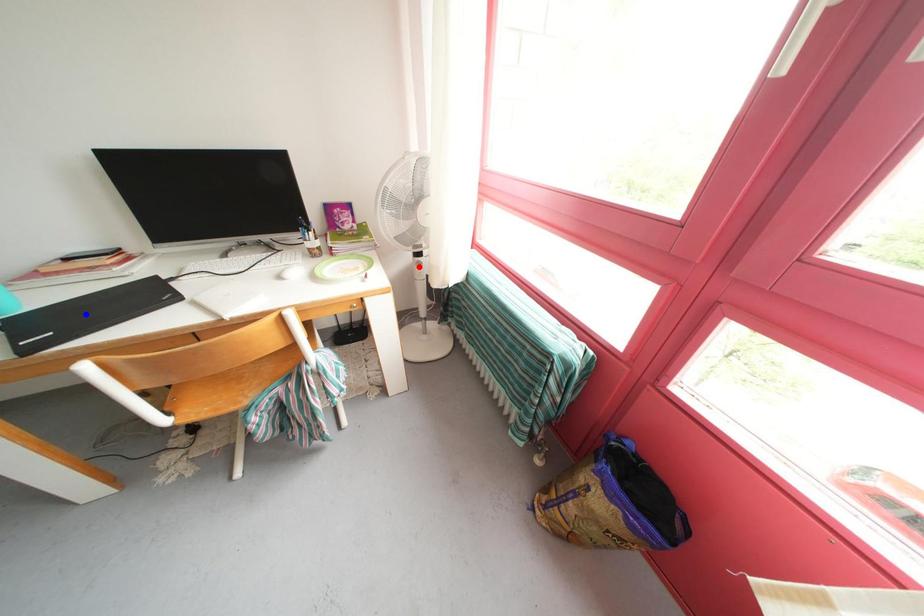
Question: Two points are marked on the image. Which point is closer to the camera?

Choices:
 (A) Blue point is closer.
 (B) Red point is closer.

Answer: (A)